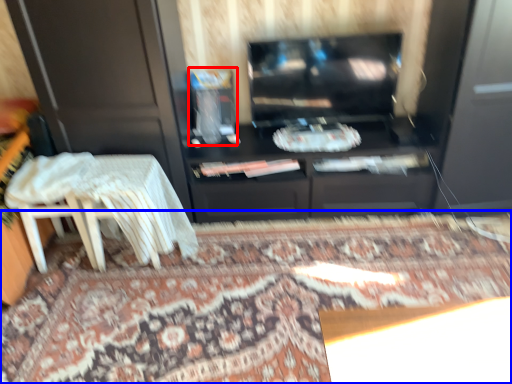
Question: Which object is closer to the camera taking this photo, appliance (highlighted by a red box) or mat (highlighted by a blue box)?

Choices:
 (A) appliance
 (B) mat

Answer: (B)